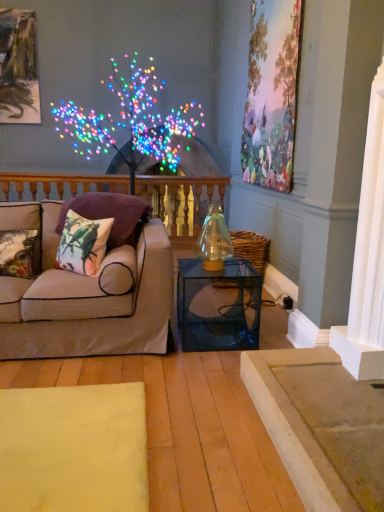
Question: From a real-world perspective, is printed fabric pillow at left, positioned as the 2th pillow in left-to-right order, above or below transparent glass table at center?

Choices:
 (A) above
 (B) below

Answer: (A)

Question: Is printed fabric pillow at left, positioned as the 2th pillow in left-to-right order, to the left or to the right of transparent glass table at center in the image?

Choices:
 (A) left
 (B) right

Answer: (A)

Question: Which of these objects is positioned closest to the transparent glass table at center?

Choices:
 (A) printed fabric pillow at left, the second pillow viewed from the right
 (B) metallic gold picture frame at upper left, placed as the 1th picture frame when sorted from back to front
 (C) pastel oil painting at upper right, the first picture frame when ordered from front to back
 (D) fluffy purple pillow at left, which is counted as the first pillow, starting from the right
 (E) wooden balustrade at upper left

Answer: (D)

Question: Based on their relative distances, which object is farther from the metallic gold picture frame at upper left, the 1th picture frame when ordered from left to right?

Choices:
 (A) floral fabric cushion at left, marked as the 1th pillow in a left-to-right arrangement
 (B) transparent glass table at center
 (C) pastel oil painting at upper right, arranged as the first picture frame when viewed from the right
 (D) wooden balustrade at upper left
 (E) fluffy purple pillow at left, marked as the third pillow in a left-to-right arrangement

Answer: (B)